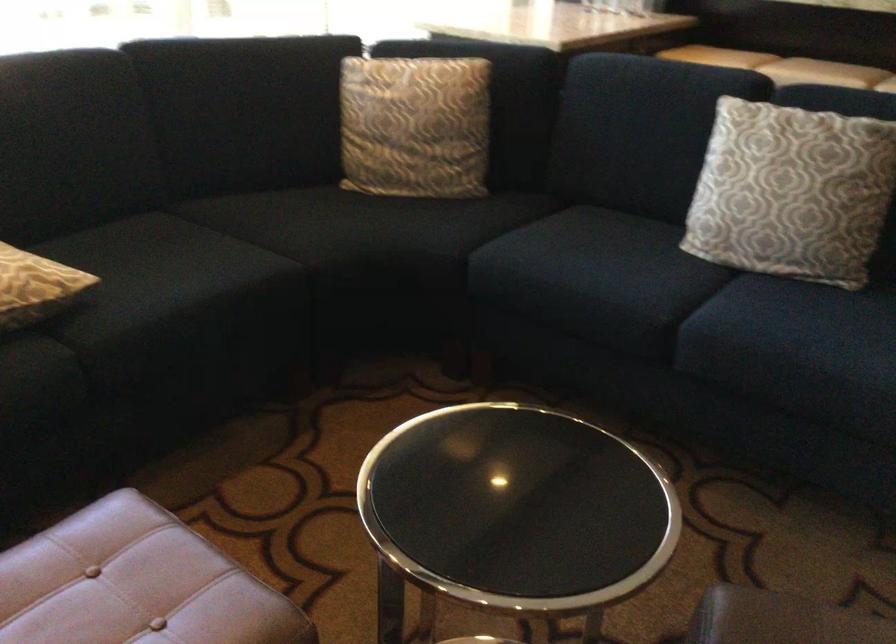
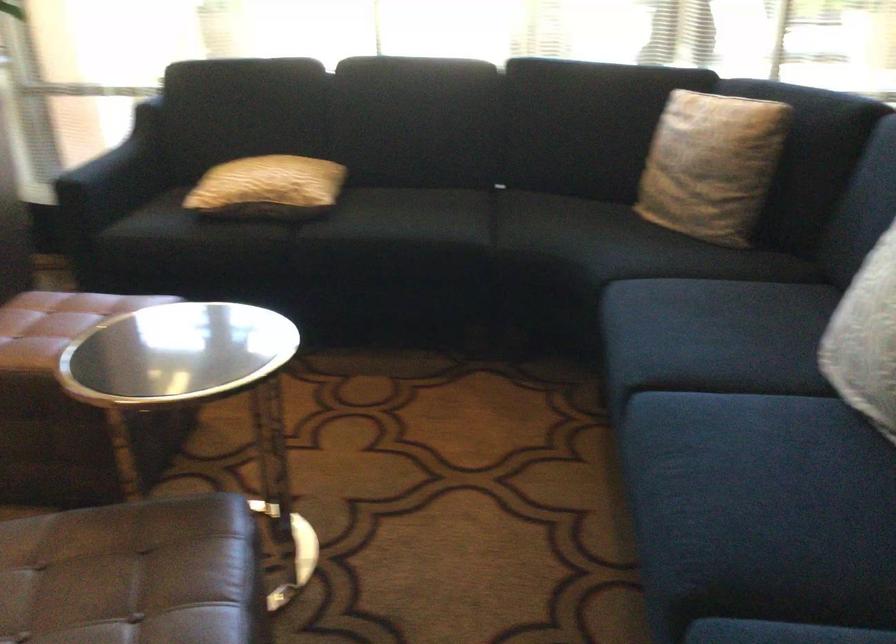
Locate, in the second image, the point that corresponds to (x=814, y=334) in the first image.

(745, 459)